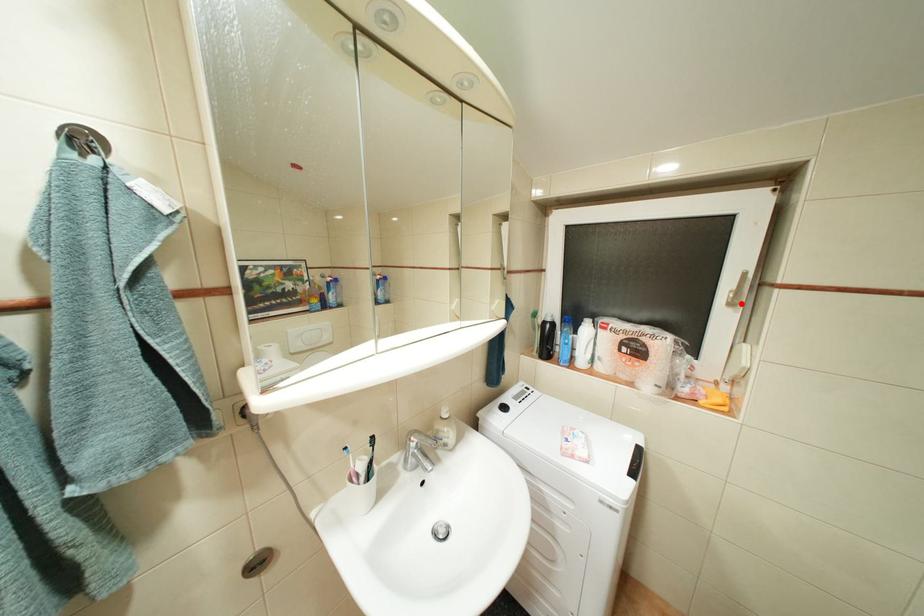
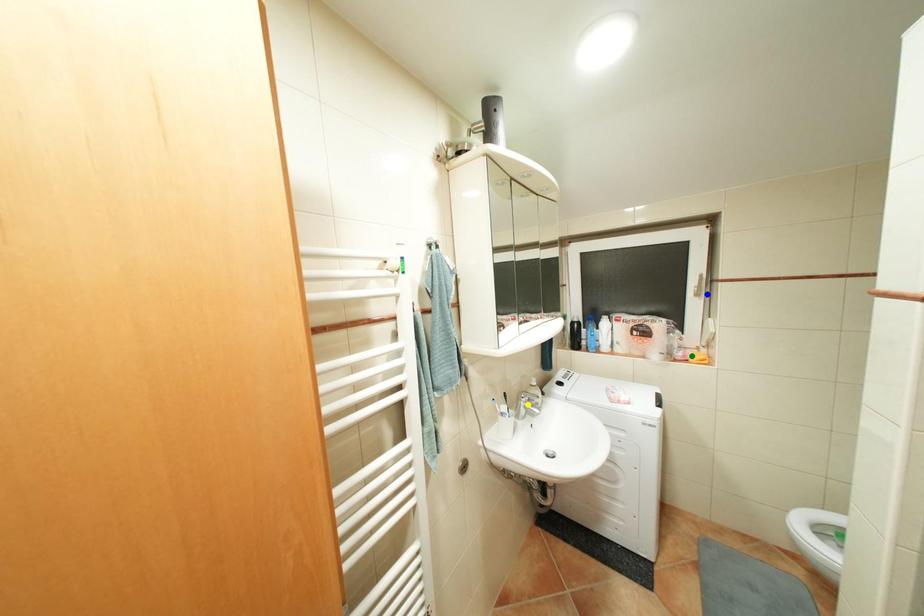
Question: I am providing you with two images of the same scene from different viewpoints. A red point is marked on the first image. You are given multiple points on the second image. In image 2, which mark is for the same physical point as the one in image 1?

Choices:
 (A) blue point
 (B) green point
 (C) yellow point

Answer: (A)